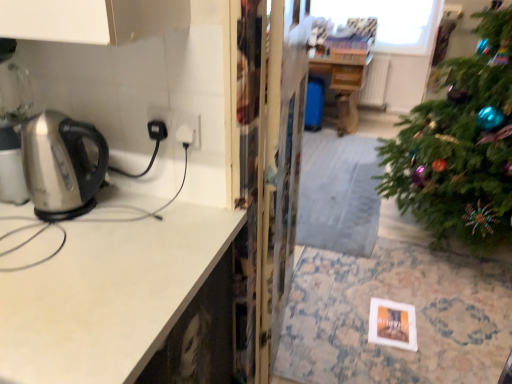
Where is `vacant area that is in front of transparent plastic screen door at center`? The image size is (512, 384). vacant area that is in front of transparent plastic screen door at center is located at coordinates (306, 346).